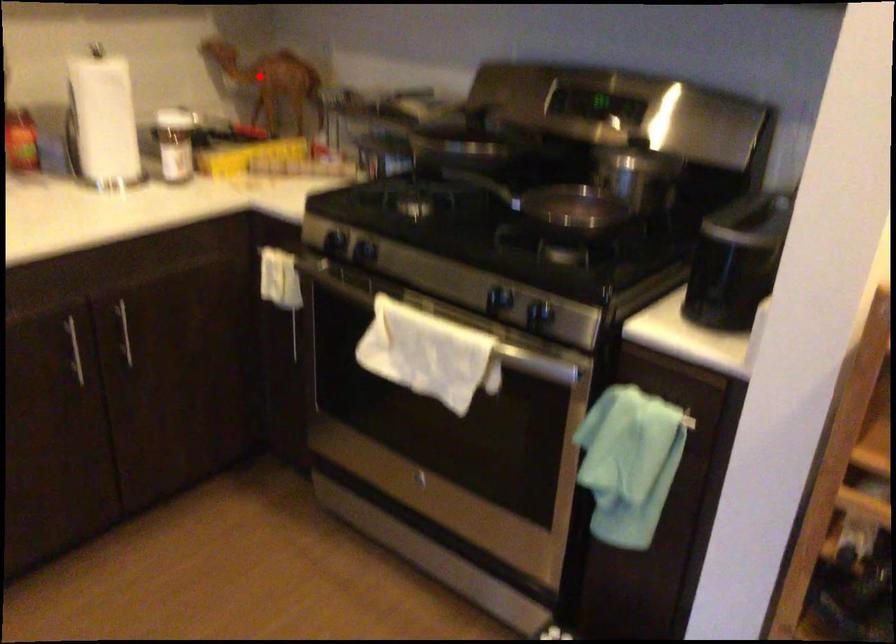
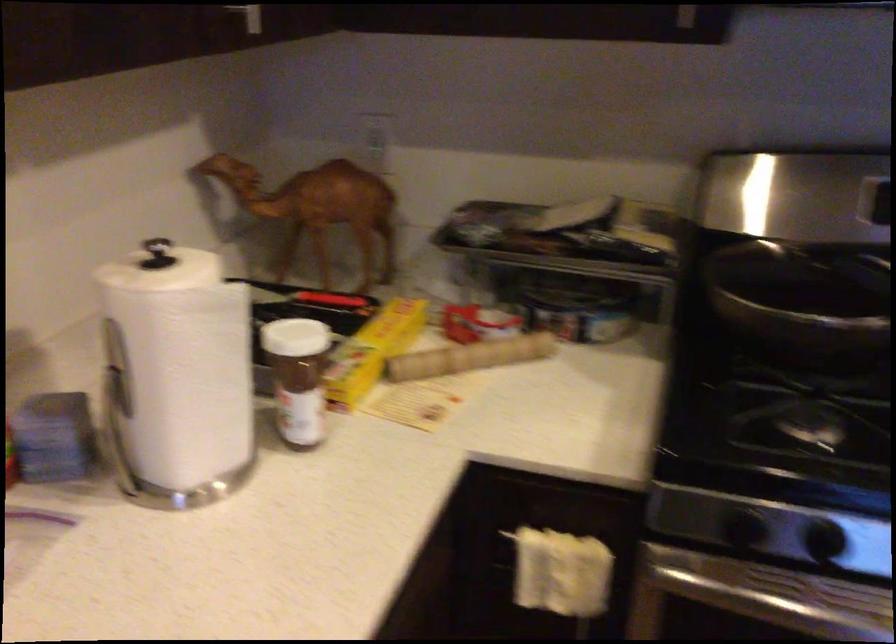
The point at the highlighted location is marked in the first image. Where is the corresponding point in the second image?

(317, 210)